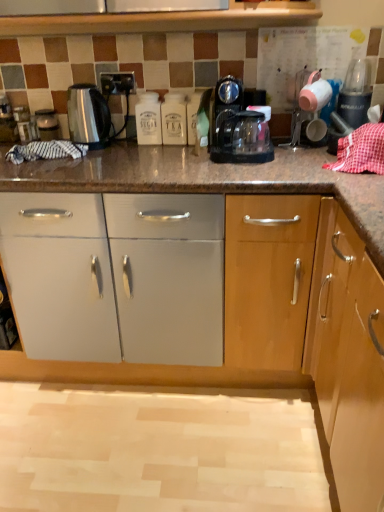
Question: Can you confirm if metallic socket at upper center is taller than white plastic tea container at center, the 2th bottle positioned from the left?

Choices:
 (A) no
 (B) yes

Answer: (A)

Question: From a real-world perspective, is metallic socket at upper center beneath white plastic tea container at center, the 2th bottle positioned from the left?

Choices:
 (A) no
 (B) yes

Answer: (A)

Question: Does metallic socket at upper center appear on the right side of white plastic tea container at center, the 2th bottle positioned from the left?

Choices:
 (A) yes
 (B) no

Answer: (B)

Question: Can you confirm if metallic socket at upper center is shorter than white plastic tea container at center, the 2th bottle positioned from the left?

Choices:
 (A) yes
 (B) no

Answer: (A)

Question: Can white plastic tea container at center, the 2th bottle positioned from the left, be found inside metallic socket at upper center?

Choices:
 (A) no
 (B) yes

Answer: (A)

Question: Is metallic socket at upper center positioned beyond the bounds of white plastic tea container at center, the 2th bottle positioned from the left?

Choices:
 (A) yes
 (B) no

Answer: (A)

Question: Considering the relative sizes of satin silver kettle at left and white matte sugar container at center, positioned as the 1th bottle in left-to-right order, in the image provided, is satin silver kettle at left smaller than white matte sugar container at center, positioned as the 1th bottle in left-to-right order,?

Choices:
 (A) yes
 (B) no

Answer: (A)

Question: Is satin silver kettle at left turned away from white matte sugar container at center, positioned as the 1th bottle in left-to-right order?

Choices:
 (A) yes
 (B) no

Answer: (B)

Question: From a real-world perspective, is satin silver kettle at left located beneath white matte sugar container at center, positioned as the 2th bottle in right-to-left order?

Choices:
 (A) yes
 (B) no

Answer: (A)

Question: Could you tell me if satin silver kettle at left is facing white matte sugar container at center, positioned as the 2th bottle in right-to-left order?

Choices:
 (A) yes
 (B) no

Answer: (B)

Question: From the image's perspective, would you say satin silver kettle at left is positioned over white matte sugar container at center, positioned as the 1th bottle in left-to-right order?

Choices:
 (A) no
 (B) yes

Answer: (A)

Question: Is satin silver kettle at left shorter than white matte sugar container at center, positioned as the 2th bottle in right-to-left order?

Choices:
 (A) no
 (B) yes

Answer: (B)

Question: Is white plastic tea container at center, which ranks as the first bottle in right-to-left order, shorter than white matte sugar container at center, positioned as the 1th bottle in left-to-right order?

Choices:
 (A) no
 (B) yes

Answer: (B)